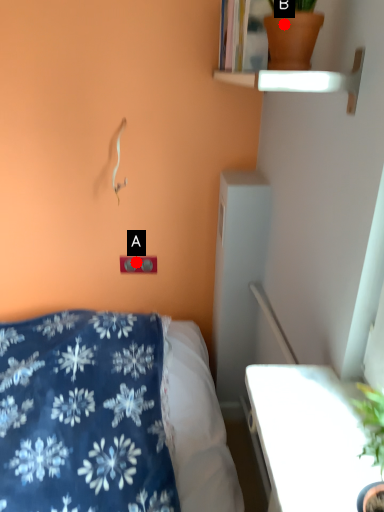
Question: Two points are circled on the image, labeled by A and B beside each circle. Which point appears farthest from the camera in this image?

Choices:
 (A) A is further
 (B) B is further

Answer: (A)